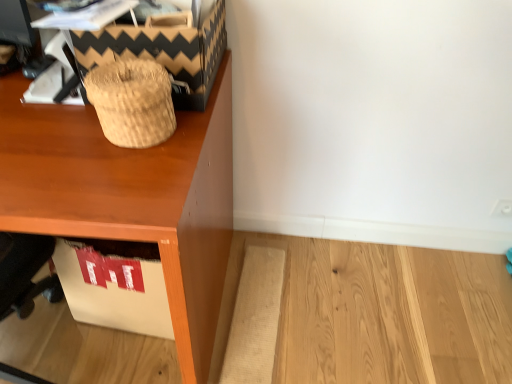
Question: Considering the relative positions of wooden desk at upper left and woven straw basket at upper left in the image provided, is wooden desk at upper left to the left or to the right of woven straw basket at upper left?

Choices:
 (A) left
 (B) right

Answer: (A)

Question: Considering the positions of wooden desk at upper left and woven straw basket at upper left in the image, is wooden desk at upper left wider or thinner than woven straw basket at upper left?

Choices:
 (A) thin
 (B) wide

Answer: (B)

Question: Which is farther from the wooden desk at upper left?

Choices:
 (A) woven straw basket at upper left
 (B) brown woven basket at upper left

Answer: (B)

Question: Considering the real-world distances, which object is closest to the woven straw basket at upper left?

Choices:
 (A) wooden desk at upper left
 (B) brown woven basket at upper left

Answer: (B)